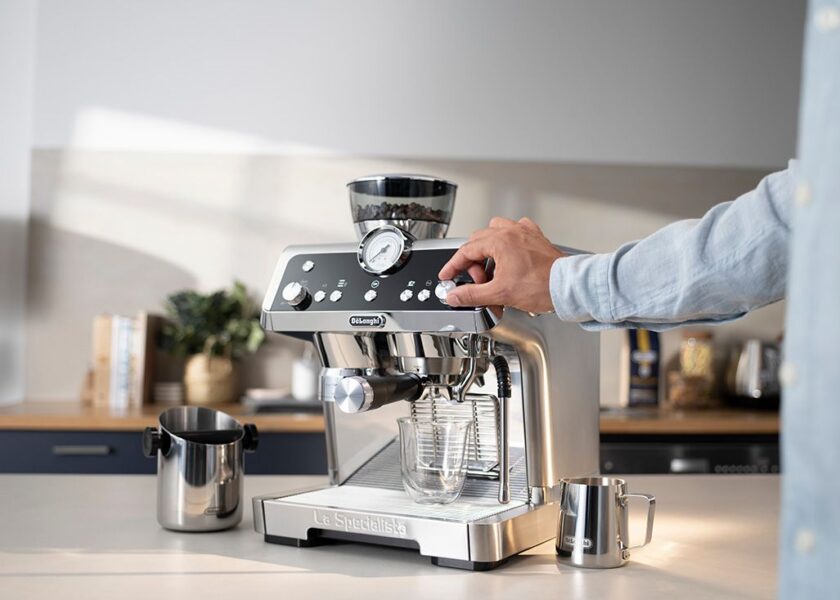
Where is `glass`? glass is located at coordinates (433, 471).